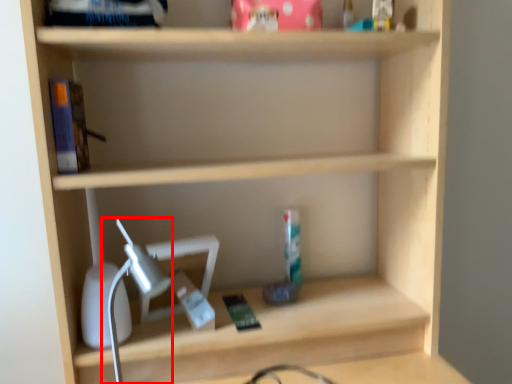
Question: From the image's perspective, where is table lamp (annotated by the red box) located in relation to book in the image?

Choices:
 (A) below
 (B) above

Answer: (A)